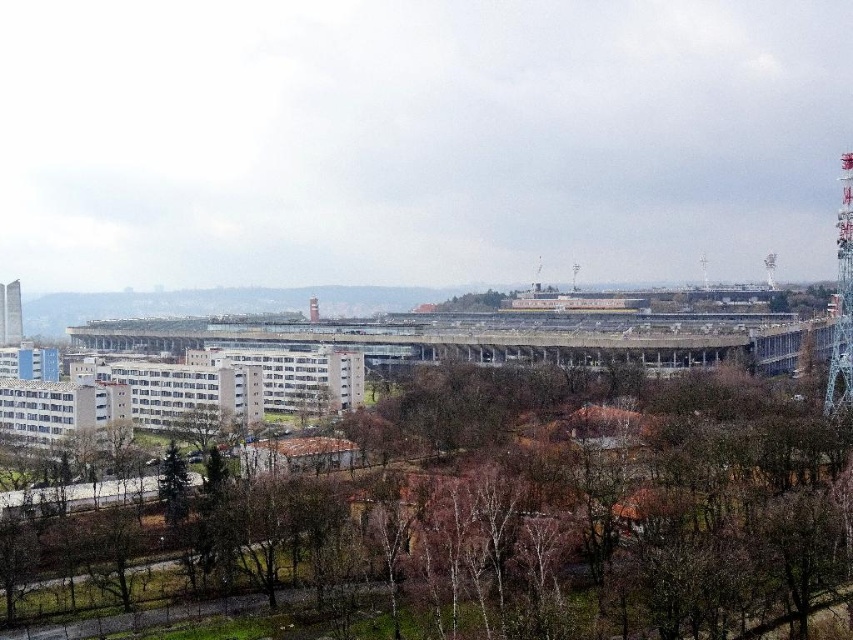
You are a city planner assessing the urban layout. You need to install a new 500 feet long cable between the metallic lattice tower at right and the smooth concrete tower at left. Based on the scene, will the cable fit between them? Please explain your reasoning.

The distance between the metallic lattice tower at right and the smooth concrete tower at left is 492.71 feet, which is shorter than the 500 feet required for the cable. Therefore, the cable will not fit between them as the existing distance is insufficient.

You are a drone operator who needs to capture aerial footage of the brown leafless tree at center. The drone has a maximum flight range of 100 meters. Based on the scene, can the drone reach the tree without exceeding its range?

The brown leafless tree at center is 101.01 meters from camera, which exceeds the drone maximum flight range of 100 meters. Therefore, the drone cannot reach the tree without exceeding its range.

You are standing in the urban landscape shown. You want to walk from the brown leafless tree at center to the metallic lattice tower at right. Which direction should you move to get closer to the tower?

The brown leafless tree at center is closer to the viewer than the metallic lattice tower at right, so you should move forward away from the tree towards the tower to get closer to it.